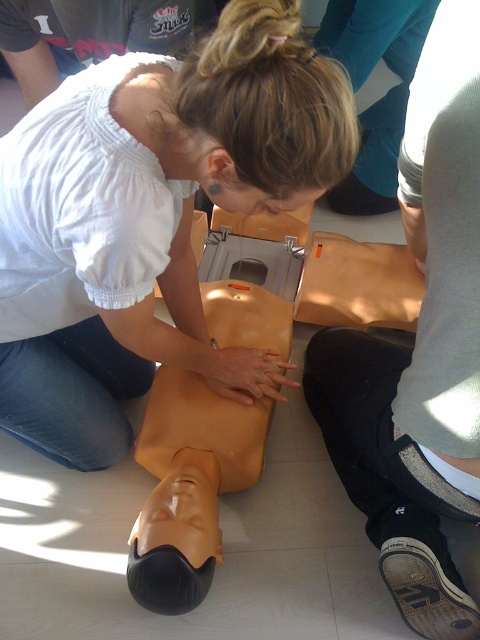
You are a first responder arriving at the scene and see the matte yellow mannequin at center and the brown canvas shoe at lower right. Which object is closer to the left side of the scene?

The matte yellow mannequin at center is closer to the left side of the scene than the brown canvas shoe at lower right.

You are a first responder entering a room and see the matte orange mannequin torso at center and the brown canvas shoe at lower right. Which object is closer to the right side of the room?

The matte orange mannequin torso at center is closer to the right side of the room because it is positioned to the right of the brown canvas shoe at lower right.